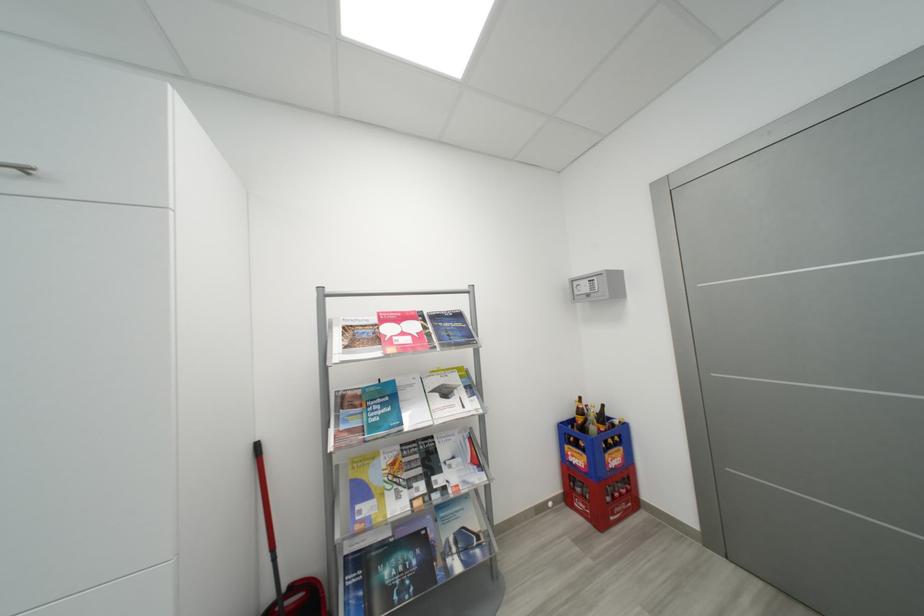
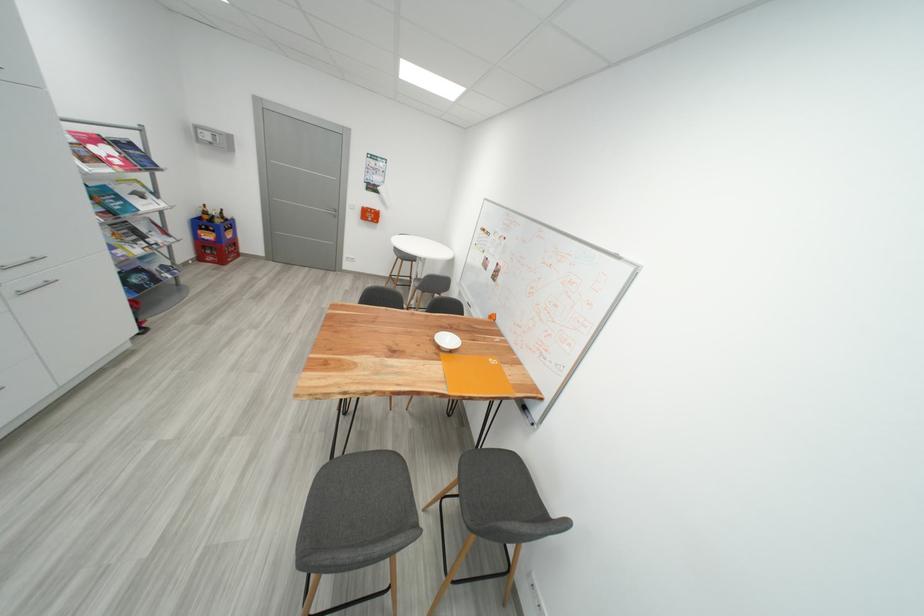
Find the pixel in the second image that matches point 385,342 in the first image.

(104, 161)